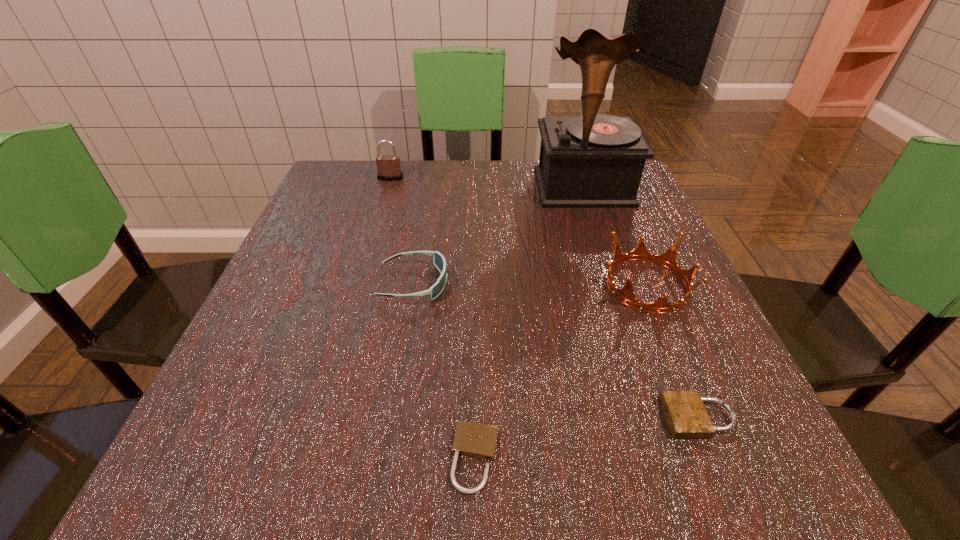
I want to click on the tallest object, so click(594, 160).

Image resolution: width=960 pixels, height=540 pixels. I want to click on the fifth shortest object, so click(x=388, y=166).

At what (x,y) coordinates should I click in order to perform the action: click on the leftmost object. Please return your answer as a coordinate pair (x, y). The image size is (960, 540). Looking at the image, I should click on (388, 166).

Identify the location of crown. (626, 295).

This screenshot has height=540, width=960. What are the coordinates of `goggles` in the screenshot? It's located at (439, 261).

I want to click on the second object from left to right, so click(439, 261).

This screenshot has height=540, width=960. Identify the location of the rightmost padlock. (686, 415).

Where is `the fifth tallest object`? the fifth tallest object is located at coordinates (686, 415).

At what (x,y) coordinates should I click in order to perform the action: click on the third object from left to right. Please return your answer as a coordinate pair (x, y). Image resolution: width=960 pixels, height=540 pixels. Looking at the image, I should click on (475, 440).

Where is `the shortest padlock`? The height and width of the screenshot is (540, 960). the shortest padlock is located at coordinates [475, 440].